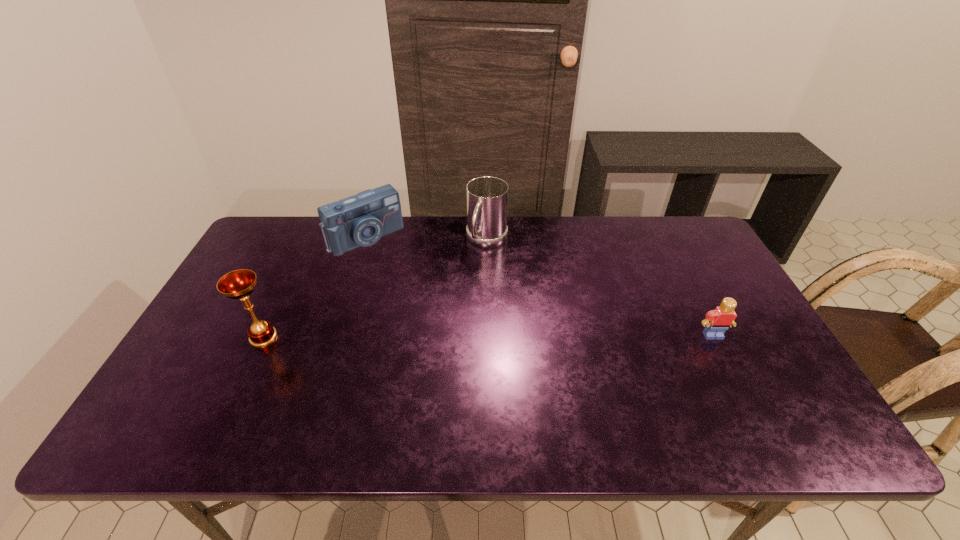
Locate an element on the screen. The height and width of the screenshot is (540, 960). free location located on the side of the third object from left to right with the handle is located at coordinates (431, 343).

The image size is (960, 540). What are the coordinates of `vacant space situated on the side of the third object from left to right with the handle` in the screenshot? It's located at (445, 319).

This screenshot has width=960, height=540. Identify the location of vacant space located on the side of the third object from left to right with the handle. (454, 304).

In order to click on camera located at the far edge in this screenshot , I will do `click(360, 220)`.

Find the location of a particular element. mug present at the far edge is located at coordinates (487, 197).

Locate an element on the screen. object situated at the left edge is located at coordinates (239, 284).

Identify the location of object that is at the right edge. (717, 321).

At what (x,y) coordinates should I click in order to perform the action: click on blank space at the far edge. Please return your answer as a coordinate pair (x, y). Image resolution: width=960 pixels, height=540 pixels. Looking at the image, I should click on (413, 248).

In the image, there is a desktop. Where is `vacant space at the near edge`? vacant space at the near edge is located at coordinates (555, 381).

Image resolution: width=960 pixels, height=540 pixels. In the image, there is a desktop. Identify the location of vacant space at the right edge. (695, 293).